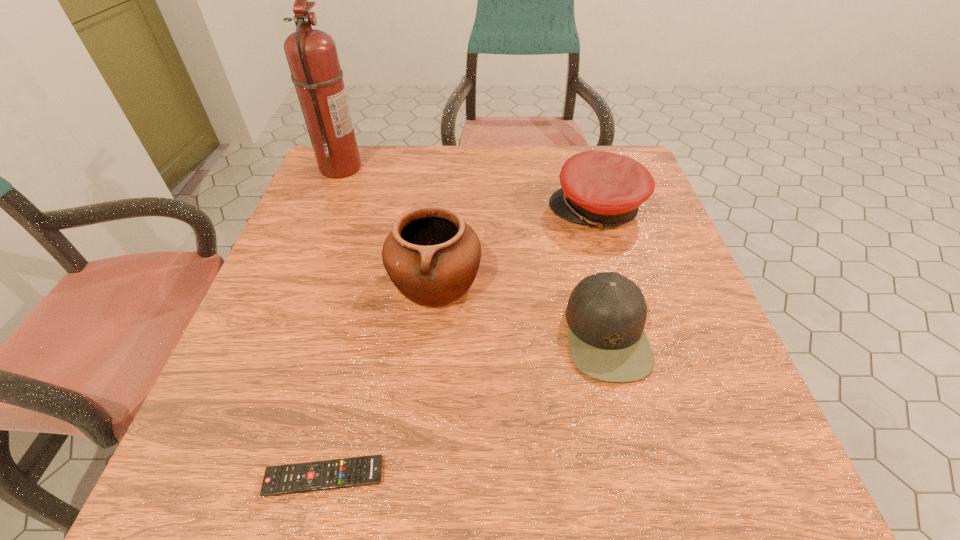
This screenshot has height=540, width=960. I want to click on free location that satisfies the following two spatial constraints: 1. on the back side of the second tallest object; 2. on the left side of the remote control, so click(x=371, y=281).